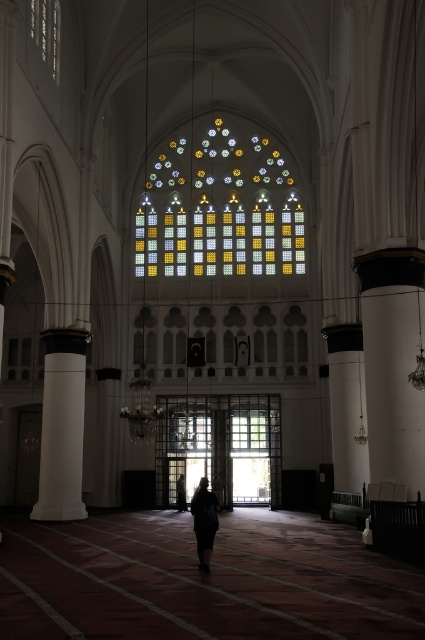
You are standing at the entrance of the mosque and want to take a photo of the multicolored stained glass at center and the dark fabric person at center. Which object should you focus on first if you want to capture both in a single frame without moving the camera?

The multicolored stained glass at center is much taller than the dark fabric person at center, so you should focus on the multicolored stained glass at center first to ensure it fits entirely within the frame.

You are a visitor entering the mosque and need to exit through the clear glass door at center. There is a black polished pillar at right nearby. Considering their widths, which one is wider?

The clear glass door at center is wider than the black polished pillar at right.

You are a visitor entering the mosque and want to find the exit. You notice a clear glass door at center and a black polished pillar at right. Which object is shorter?

The clear glass door at center is shorter than the black polished pillar at right.